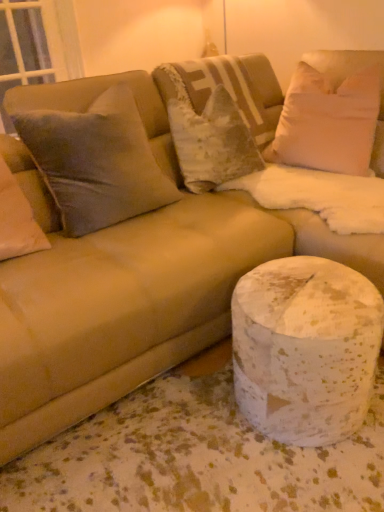
This screenshot has width=384, height=512. Describe the element at coordinates (96, 162) in the screenshot. I see `velvet gray pillow at upper left, which ranks as the 4th pillow in right-to-left order` at that location.

Where is `velvet gray pillow at upper left, acting as the 2th pillow starting from the left`? The image size is (384, 512). velvet gray pillow at upper left, acting as the 2th pillow starting from the left is located at coordinates (96, 162).

The height and width of the screenshot is (512, 384). Identify the location of white soft pillow at upper right, the 5th pillow in the left-to-right sequence. (327, 122).

This screenshot has width=384, height=512. What do you see at coordinates (211, 140) in the screenshot?
I see `velvet textured pillow at center, acting as the 4th pillow starting from the left` at bounding box center [211, 140].

The image size is (384, 512). Describe the element at coordinates (305, 348) in the screenshot. I see `white speckled marble at lower right` at that location.

I want to click on suede pillow at left, which is the first pillow from left to right, so click(17, 219).

In order to face transparent glass window screen at upper left, should I rotate leftwards or rightwards?

To face it directly, rotate left by 21.279 degrees.

At what (x,y) coordinates should I click in order to perform the action: click on transparent glass window screen at upper left. Please return your answer as a coordinate pair (x, y). Looking at the image, I should click on (36, 44).

Where is `velvet gray pillow at upper left, which ranks as the 4th pillow in right-to-left order`? velvet gray pillow at upper left, which ranks as the 4th pillow in right-to-left order is located at coordinates (96, 162).

In terms of height, does velvet beige pillow at center, the 3th pillow in the left-to-right sequence, look taller or shorter compared to white speckled marble at lower right?

Considering their sizes, velvet beige pillow at center, the 3th pillow in the left-to-right sequence, has more height than white speckled marble at lower right.

In the scene shown: How different are the orientations of velvet beige pillow at center, the 3th pillow in the left-to-right sequence, and white speckled marble at lower right in degrees?

88.1 degrees.

Looking at this image, between velvet beige pillow at center, the 3th pillow in the left-to-right sequence, and white speckled marble at lower right, which one has smaller size?

With smaller size is white speckled marble at lower right.

From the image's perspective, is velvet beige pillow at center, the 3th pillow in the left-to-right sequence, beneath white speckled marble at lower right?

No, from the image's perspective, velvet beige pillow at center, the 3th pillow in the left-to-right sequence, is not below white speckled marble at lower right.

Are suede pillow at left, which is counted as the fifth pillow, starting from the right, and velvet beige pillow at center, placed as the third pillow when sorted from right to left, located far from each other?

Indeed, suede pillow at left, which is counted as the fifth pillow, starting from the right, is not near velvet beige pillow at center, placed as the third pillow when sorted from right to left.

Which object is further away from the camera, suede pillow at left, which is the first pillow from left to right, or velvet beige pillow at center, placed as the third pillow when sorted from right to left?

velvet beige pillow at center, placed as the third pillow when sorted from right to left, is more distant.

In the scene shown: Which object is positioned more to the right, suede pillow at left, which is counted as the fifth pillow, starting from the right, or velvet beige pillow at center, placed as the third pillow when sorted from right to left?

velvet beige pillow at center, placed as the third pillow when sorted from right to left, is more to the right.

Does suede pillow at left, which is the first pillow from left to right, have a smaller size compared to velvet beige pillow at center, placed as the third pillow when sorted from right to left?

Correct, suede pillow at left, which is the first pillow from left to right, occupies less space than velvet beige pillow at center, placed as the third pillow when sorted from right to left.

Is transparent glass window screen at upper left beside white speckled marble at lower right?

No, transparent glass window screen at upper left is not making contact with white speckled marble at lower right.

Looking at this image, based on their positions, is transparent glass window screen at upper left located to the left or right of white speckled marble at lower right?

Based on their positions, transparent glass window screen at upper left is located to the left of white speckled marble at lower right.

Is transparent glass window screen at upper left situated inside white speckled marble at lower right or outside?

transparent glass window screen at upper left is not inside white speckled marble at lower right, it's outside.

Consider the image. Is transparent glass window screen at upper left oriented away from white speckled marble at lower right?

No, white speckled marble at lower right is not at the back of transparent glass window screen at upper left.

Does white speckled marble at lower right have a smaller size compared to velvet beige pillow at center, placed as the third pillow when sorted from right to left?

Yes.

Relative to velvet beige pillow at center, the 3th pillow in the left-to-right sequence, is white speckled marble at lower right in front or behind?

Visually, white speckled marble at lower right is located in front of velvet beige pillow at center, the 3th pillow in the left-to-right sequence.

From the image's perspective, which one is positioned higher, white speckled marble at lower right or velvet beige pillow at center, the 3th pillow in the left-to-right sequence?

velvet beige pillow at center, the 3th pillow in the left-to-right sequence, is shown above in the image.

Which of these two, white speckled marble at lower right or velvet beige pillow at center, placed as the third pillow when sorted from right to left, is thinner?

Thinner between the two is white speckled marble at lower right.

From a real-world perspective, which is physically below, transparent glass window screen at upper left or white soft pillow at upper right, the 1th pillow positioned from the right?

white soft pillow at upper right, the 1th pillow positioned from the right, from a real-world perspective.

Considering the sizes of objects transparent glass window screen at upper left and white soft pillow at upper right, the 1th pillow positioned from the right, in the image provided, who is taller, transparent glass window screen at upper left or white soft pillow at upper right, the 1th pillow positioned from the right,?

transparent glass window screen at upper left.

What's the angular difference between transparent glass window screen at upper left and white soft pillow at upper right, the 5th pillow in the left-to-right sequence,'s facing directions?

The angle between the facing direction of transparent glass window screen at upper left and the facing direction of white soft pillow at upper right, the 5th pillow in the left-to-right sequence, is 82.9 degrees.

Considering the points (73, 112) and (347, 173), which point is in front, point (73, 112) or point (347, 173)?

Point (73, 112)

From the image's perspective, is velvet gray pillow at upper left, acting as the 2th pillow starting from the left, under white soft pillow at upper right, the 5th pillow in the left-to-right sequence?

Yes, from the image's perspective, velvet gray pillow at upper left, acting as the 2th pillow starting from the left, is beneath white soft pillow at upper right, the 5th pillow in the left-to-right sequence.

Consider the image. Can you tell me how much velvet gray pillow at upper left, which ranks as the 4th pillow in right-to-left order, and white soft pillow at upper right, the 5th pillow in the left-to-right sequence, differ in facing direction?

velvet gray pillow at upper left, which ranks as the 4th pillow in right-to-left order, and white soft pillow at upper right, the 5th pillow in the left-to-right sequence, are facing 78.5 degrees away from each other.

Between velvet textured pillow at center, acting as the 4th pillow starting from the left, and velvet gray pillow at upper left, acting as the 2th pillow starting from the left, which one has smaller width?

With smaller width is velvet textured pillow at center, acting as the 4th pillow starting from the left.

From the image's perspective, starting from the velvet gray pillow at upper left, acting as the 2th pillow starting from the left, which pillow is the 1st one above? Please provide its 2D coordinates.

[(211, 140)]

Could you tell me if velvet textured pillow at center, acting as the second pillow starting from the right, is turned towards velvet gray pillow at upper left, which ranks as the 4th pillow in right-to-left order?

No, velvet textured pillow at center, acting as the second pillow starting from the right, is not facing towards velvet gray pillow at upper left, which ranks as the 4th pillow in right-to-left order.

From a real-world perspective, starting from the white speckled marble at lower right, which pillow is the 4th one vertically above it? Please provide its 2D coordinates.

[(227, 88)]

The height and width of the screenshot is (512, 384). Find the location of `the 2nd pillow to the right when counting from the suede pillow at left, which is counted as the fifth pillow, starting from the right`. the 2nd pillow to the right when counting from the suede pillow at left, which is counted as the fifth pillow, starting from the right is located at coordinates (227, 88).

Considering their positions, is suede pillow at left, which is counted as the fifth pillow, starting from the right, positioned further to white speckled marble at lower right than white soft pillow at upper right, the 5th pillow in the left-to-right sequence?

Among the two, white soft pillow at upper right, the 5th pillow in the left-to-right sequence, is located further to white speckled marble at lower right.

Estimate the real-world distances between objects in this image. Which object is further from white speckled marble at lower right, velvet textured pillow at center, acting as the second pillow starting from the right, or suede pillow at left, which is counted as the fifth pillow, starting from the right?

suede pillow at left, which is counted as the fifth pillow, starting from the right, is further to white speckled marble at lower right.

Looking at the image, which one is located further to suede pillow at left, which is counted as the fifth pillow, starting from the right, velvet gray pillow at upper left, which ranks as the 4th pillow in right-to-left order, or white speckled marble at lower right?

Among the two, white speckled marble at lower right is located further to suede pillow at left, which is counted as the fifth pillow, starting from the right.

Considering their positions, is velvet textured pillow at center, acting as the 4th pillow starting from the left, positioned further to white soft pillow at upper right, the 5th pillow in the left-to-right sequence, than suede pillow at left, which is the first pillow from left to right?

suede pillow at left, which is the first pillow from left to right.

Looking at the image, which one is located closer to transparent glass window screen at upper left, suede pillow at left, which is the first pillow from left to right, or white soft pillow at upper right, the 1th pillow positioned from the right?

The object closer to transparent glass window screen at upper left is white soft pillow at upper right, the 1th pillow positioned from the right.

Considering their positions, is white speckled marble at lower right positioned closer to velvet textured pillow at center, acting as the 4th pillow starting from the left, than velvet beige pillow at center, the 3th pillow in the left-to-right sequence?

Among the two, velvet beige pillow at center, the 3th pillow in the left-to-right sequence, is located nearer to velvet textured pillow at center, acting as the 4th pillow starting from the left.

Based on their spatial positions, is white soft pillow at upper right, the 5th pillow in the left-to-right sequence, or transparent glass window screen at upper left further from velvet gray pillow at upper left, which ranks as the 4th pillow in right-to-left order?

The object further to velvet gray pillow at upper left, which ranks as the 4th pillow in right-to-left order, is transparent glass window screen at upper left.

Which object lies nearer to the anchor point suede pillow at left, which is the first pillow from left to right, white speckled marble at lower right or velvet textured pillow at center, acting as the 4th pillow starting from the left?

Based on the image, velvet textured pillow at center, acting as the 4th pillow starting from the left, appears to be nearer to suede pillow at left, which is the first pillow from left to right.

Where is `marble situated between transparent glass window screen at upper left and white soft pillow at upper right, the 5th pillow in the left-to-right sequence, from left to right`? Image resolution: width=384 pixels, height=512 pixels. marble situated between transparent glass window screen at upper left and white soft pillow at upper right, the 5th pillow in the left-to-right sequence, from left to right is located at coordinates (305, 348).

This screenshot has width=384, height=512. What are the coordinates of `pillow located between velvet beige pillow at center, placed as the third pillow when sorted from right to left, and white soft pillow at upper right, the 1th pillow positioned from the right, in the left-right direction` in the screenshot? It's located at (211, 140).

The height and width of the screenshot is (512, 384). I want to click on marble situated between velvet gray pillow at upper left, which ranks as the 4th pillow in right-to-left order, and white soft pillow at upper right, the 1th pillow positioned from the right, from left to right, so click(305, 348).

This screenshot has height=512, width=384. What are the coordinates of `marble located between suede pillow at left, which is the first pillow from left to right, and white soft pillow at upper right, the 1th pillow positioned from the right, in the left-right direction` in the screenshot? It's located at (305, 348).